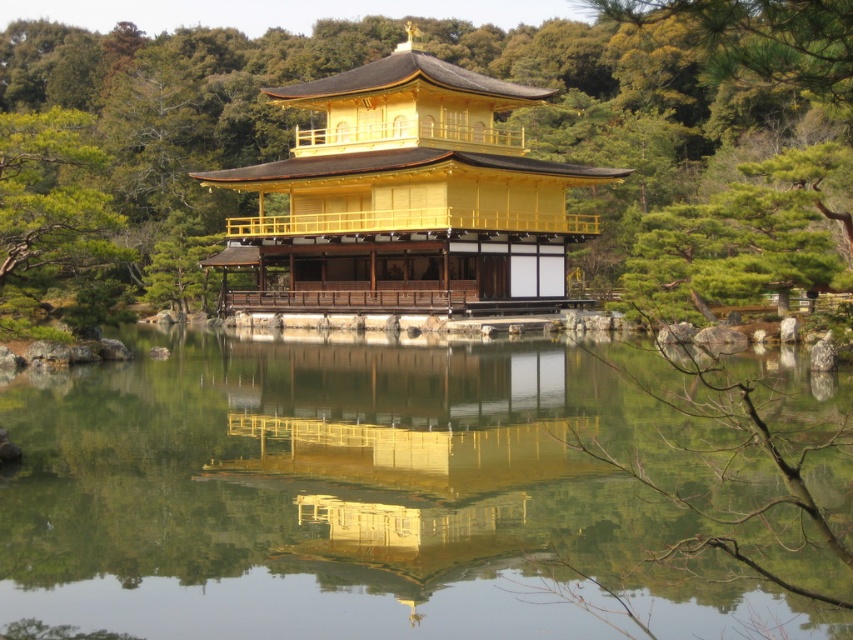
Question: Is green leafy tree at center further to camera compared to golden polished wood pagoda at center?

Choices:
 (A) no
 (B) yes

Answer: (A)

Question: Which of the following is the farthest from the observer?

Choices:
 (A) golden polished wood pagoda at center
 (B) transparent glass water at center

Answer: (A)

Question: Considering the relative positions of transparent glass water at center and golden polished wood pagoda at center in the image provided, where is transparent glass water at center located with respect to golden polished wood pagoda at center?

Choices:
 (A) right
 (B) left

Answer: (A)

Question: Which object is closer to the camera taking this photo?

Choices:
 (A) transparent glass water at center
 (B) green leafy tree at center
 (C) golden polished wood pagoda at center

Answer: (B)

Question: Which point appears closest to the camera in this image?

Choices:
 (A) (106, 483)
 (B) (321, 157)

Answer: (A)

Question: Is transparent glass water at center smaller than golden polished wood pagoda at center?

Choices:
 (A) yes
 (B) no

Answer: (A)